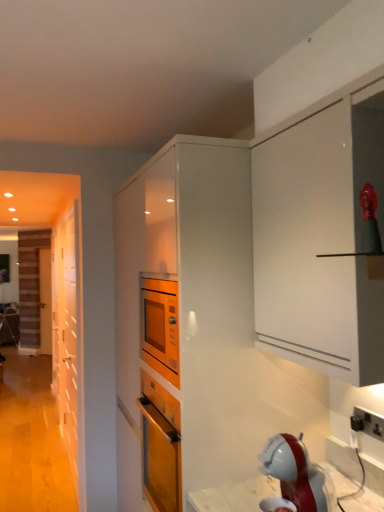
Question: Does wooden door at left, which is the 2th door from back to front, have a greater width compared to black plastic electrical outlet at lower right?

Choices:
 (A) yes
 (B) no

Answer: (A)

Question: From the image's perspective, is wooden door at left, marked as the second door in a left-to-right arrangement, located above black plastic electrical outlet at lower right?

Choices:
 (A) yes
 (B) no

Answer: (B)

Question: Does wooden door at left, the 1th door positioned from the front, have a lesser width compared to black plastic electrical outlet at lower right?

Choices:
 (A) yes
 (B) no

Answer: (B)

Question: Can we say wooden door at left, marked as the second door in a left-to-right arrangement, lies outside black plastic electrical outlet at lower right?

Choices:
 (A) no
 (B) yes

Answer: (B)

Question: Can you confirm if wooden door at left, the first door when ordered from right to left, is taller than black plastic electrical outlet at lower right?

Choices:
 (A) yes
 (B) no

Answer: (A)

Question: Is wooden door at left, marked as the second door in a left-to-right arrangement, directly adjacent to black plastic electrical outlet at lower right?

Choices:
 (A) no
 (B) yes

Answer: (A)

Question: Is wooden at left, the first door when ordered from left to right, shorter than wooden door at left, the 1th door positioned from the front?

Choices:
 (A) no
 (B) yes

Answer: (B)

Question: Does wooden at left, placed as the 2th door when sorted from front to back, have a greater height compared to wooden door at left, the 1th door positioned from the front?

Choices:
 (A) yes
 (B) no

Answer: (B)

Question: Can you confirm if wooden at left, placed as the 2th door when sorted from front to back, is positioned to the left of wooden door at left, marked as the second door in a left-to-right arrangement?

Choices:
 (A) no
 (B) yes

Answer: (B)

Question: Can you confirm if wooden at left, placed as the 2th door when sorted from front to back, is bigger than wooden door at left, the 1th door positioned from the front?

Choices:
 (A) yes
 (B) no

Answer: (B)

Question: From a real-world perspective, is wooden at left, the first door when ordered from left to right, positioned under wooden door at left, marked as the second door in a left-to-right arrangement, based on gravity?

Choices:
 (A) no
 (B) yes

Answer: (A)

Question: Does wooden at left, placed as the 1th door when sorted from back to front, have a greater width compared to wooden door at left, marked as the second door in a left-to-right arrangement?

Choices:
 (A) yes
 (B) no

Answer: (A)

Question: Is black plastic electrical outlet at lower right outside white glossy cabinet at center?

Choices:
 (A) no
 (B) yes

Answer: (B)